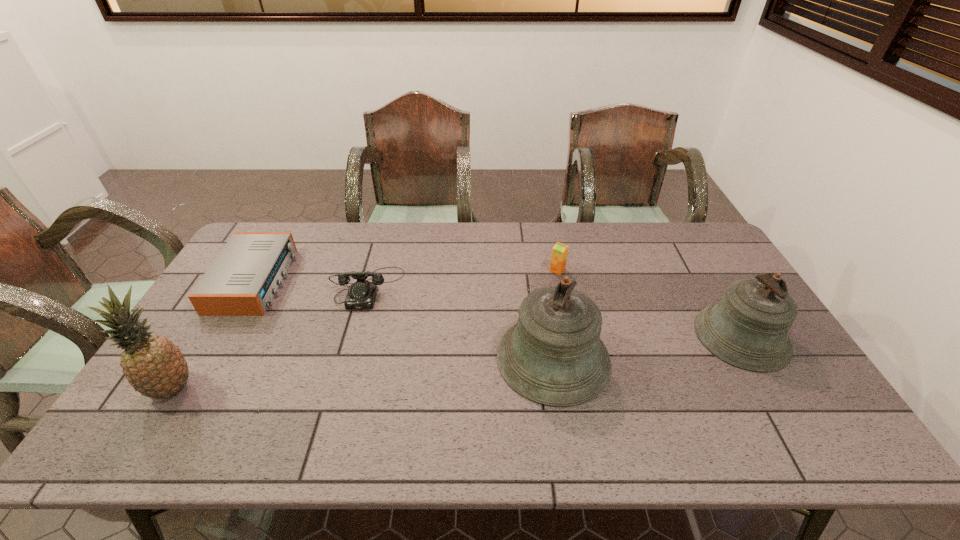
Image resolution: width=960 pixels, height=540 pixels. Find the location of `object at the near left corner`. object at the near left corner is located at coordinates (154, 366).

In the image, there is a desktop. Where is `blank space at the far edge`? blank space at the far edge is located at coordinates (459, 260).

The width and height of the screenshot is (960, 540). In the image, there is a desktop. Find the location of `vacant space at the near edge`. vacant space at the near edge is located at coordinates (256, 387).

Locate an element on the screen. free spot at the right edge of the desktop is located at coordinates [793, 368].

You are a GUI agent. You are given a task and a screenshot of the screen. Output one action in this format:
    pyautogui.click(x=<x>, y=<y>)
    Task: Click on the free space at the far right corner
    The image size is (960, 540).
    Given the screenshot: What is the action you would take?
    pyautogui.click(x=664, y=222)

The height and width of the screenshot is (540, 960). What are the coordinates of `vacant area that lies between the pineapple and the radio receiver` in the screenshot? It's located at (213, 335).

Locate an element on the screen. Image resolution: width=960 pixels, height=540 pixels. vacant region between the third object from left to right and the orange juice is located at coordinates (463, 279).

Where is `free space that is in between the fourth tallest object and the rightmost object`? The height and width of the screenshot is (540, 960). free space that is in between the fourth tallest object and the rightmost object is located at coordinates (650, 303).

Identify the location of free space between the third tallest object and the orange juice. The height and width of the screenshot is (540, 960). (650, 303).

You are a GUI agent. You are given a task and a screenshot of the screen. Output one action in this format:
    pyautogui.click(x=<x>, y=<y>)
    Task: Click on the vacant area that lies between the pineapple and the rightmost object
    
    Given the screenshot: What is the action you would take?
    pyautogui.click(x=457, y=363)